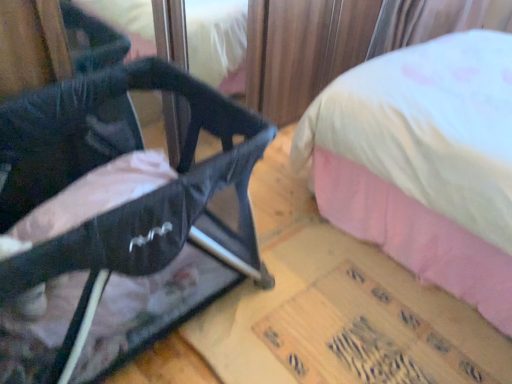
Describe the element at coordinates (151, 192) in the screenshot. The image size is (512, 384). I see `black mesh chair at left` at that location.

The width and height of the screenshot is (512, 384). I want to click on black mesh chair at left, so click(151, 192).

You are a GUI agent. You are given a task and a screenshot of the screen. Output one action in this format:
    pyautogui.click(x=<x>, y=<y>)
    Task: Click on the black mesh chair at left
    
    Given the screenshot: What is the action you would take?
    pyautogui.click(x=151, y=192)